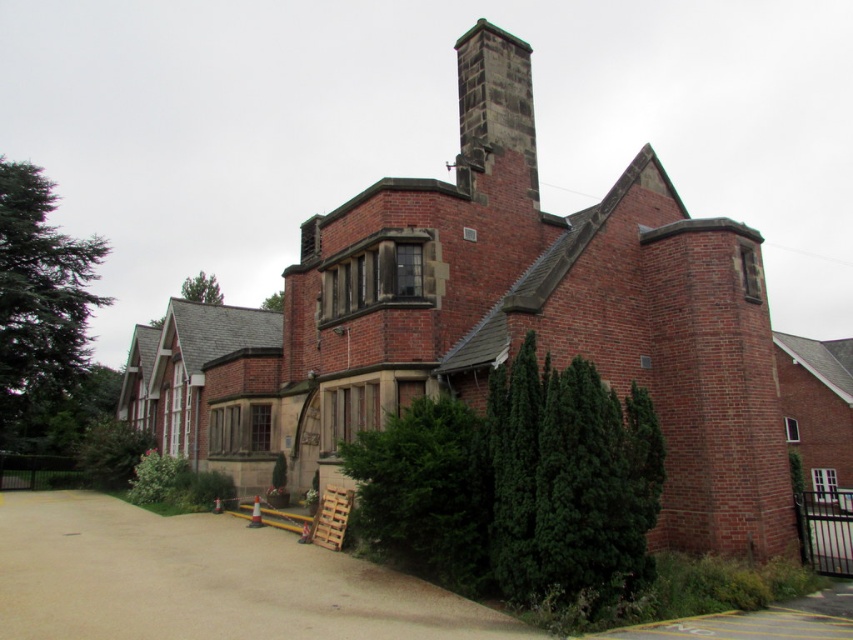
You are a visitor arriving at the property and see the red brick church at center and the brown gravel driveway at lower left. Which object takes up more space in the image?

The red brick church at center has a larger size compared to the brown gravel driveway at lower left, so it takes up more space in the image.

You are standing at the entrance of the building and want to walk to the dark gray stone chimney at upper center. Which direction should you look to see the brown gravel driveway at lower left first?

The brown gravel driveway at lower left has a lesser height compared to the dark gray stone chimney at upper center, so you should look downward to see the brown gravel driveway at lower left first before looking upward toward the chimney.